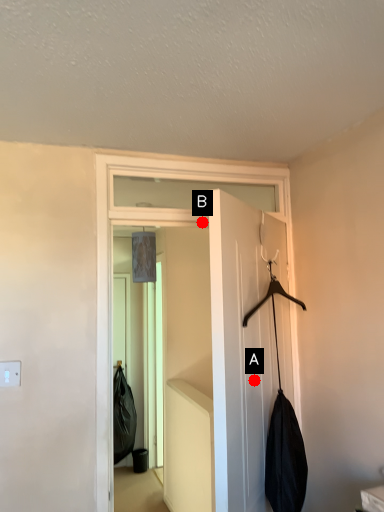
Question: Two points are circled on the image, labeled by A and B beside each circle. Which of the following is the closest to the observer?

Choices:
 (A) A is closer
 (B) B is closer

Answer: (A)